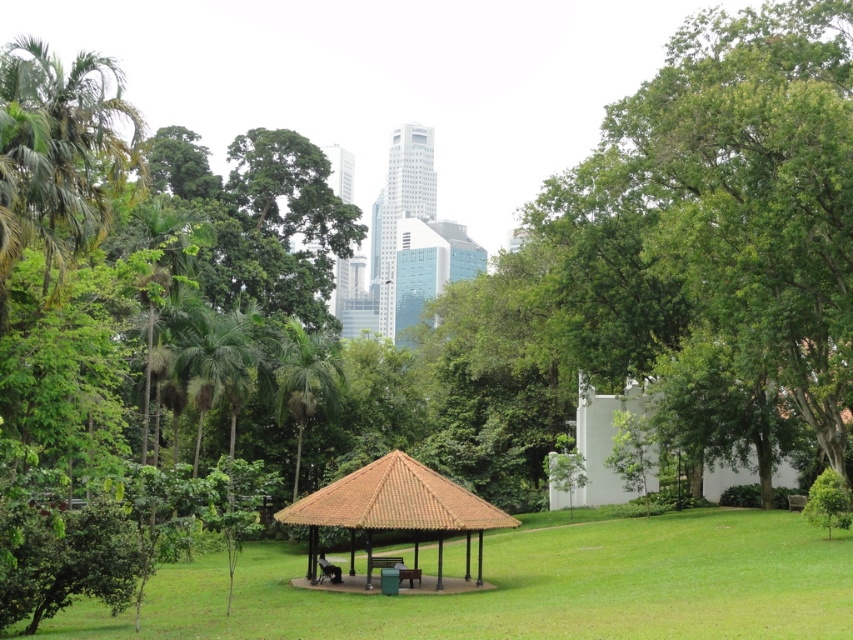
Question: Which of the following is the closest to the observer?

Choices:
 (A) brown wooden picnic table at center
 (B) white matte/hardobject at center-right
 (C) green leafy tree at center
 (D) green leafy palm at left

Answer: (D)

Question: Can you confirm if brown thatched roof gazebo at center is thinner than white matte/hardobject at center-right?

Choices:
 (A) yes
 (B) no

Answer: (A)

Question: Does green leafy tree at center have a smaller size compared to brown thatched roof gazebo at center?

Choices:
 (A) yes
 (B) no

Answer: (B)

Question: Estimate the real-world distances between objects in this image. Which object is closer to the green leafy tree at center?

Choices:
 (A) white matte/hardobject at center-right
 (B) brown wooden picnic table at center

Answer: (A)

Question: Which of these objects is positioned closest to the white matte/hardobject at center-right?

Choices:
 (A) green leafy tree at center
 (B) brown wooden picnic table at center
 (C) green leafy palm at left

Answer: (A)

Question: Is green leafy tree at center closer to camera compared to white matte/hardobject at center-right?

Choices:
 (A) yes
 (B) no

Answer: (A)